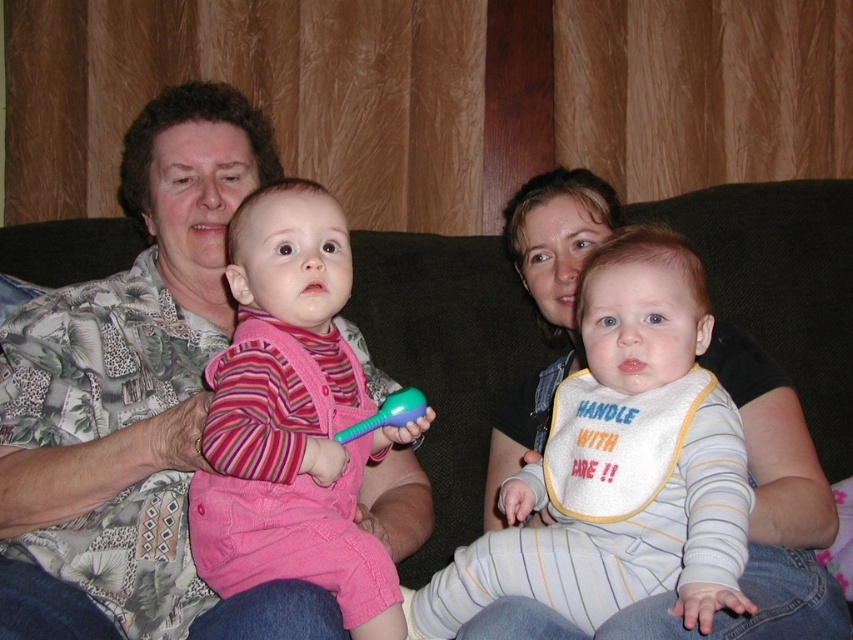
You are designing a layout for a clothing catalog and need to place the printed fabric shirt at left and the pink corduroy overalls at center. Based on their sizes, which item should be placed first in the catalog layout to emphasize the size difference?

The printed fabric shirt at left should be placed first in the catalog layout since it is larger in size than the pink corduroy overalls at center, allowing the size difference to be highlighted effectively.

You are a photographer setting up a shoot in this living room. You need to ensure that the printed fabric shirt at left and the white striped bib at center are both visible in the frame. Based on their positions, which object should you adjust to avoid being blocked?

The white striped bib at center is behind the printed fabric shirt at left, so you should adjust the white striped bib at center to move it forward to ensure it is visible.

You are a photographer setting up for a family photo. You need to place a small prop between the white striped bib at center and the pink corduroy overalls at center. Which object should the prop be closer to if you want it to fit within the narrower space?

The prop should be closer to the pink corduroy overalls at center because its width is narrower than the white striped bib at center.